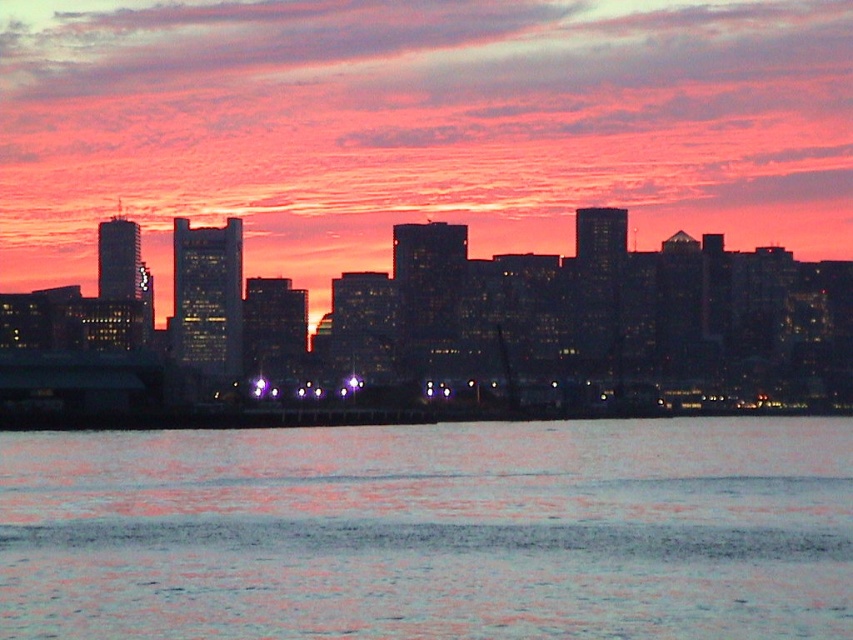
Can you confirm if reflective silver water at lower center is smaller than black glass buildings at center?

Yes, reflective silver water at lower center is smaller than black glass buildings at center.

Image resolution: width=853 pixels, height=640 pixels. What do you see at coordinates (432, 531) in the screenshot? I see `reflective silver water at lower center` at bounding box center [432, 531].

At what (x,y) coordinates should I click in order to perform the action: click on reflective silver water at lower center. Please return your answer as a coordinate pair (x, y). The image size is (853, 640). Looking at the image, I should click on (432, 531).